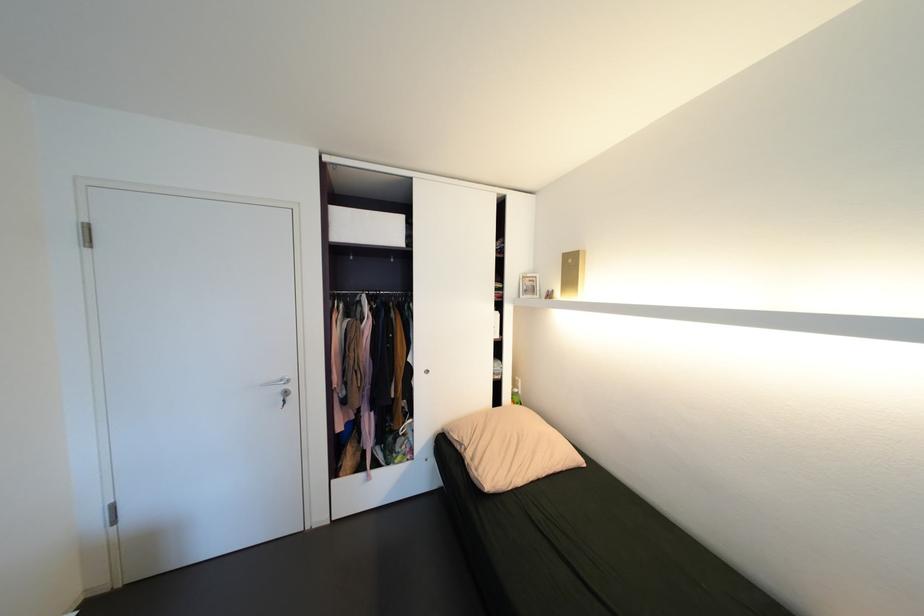
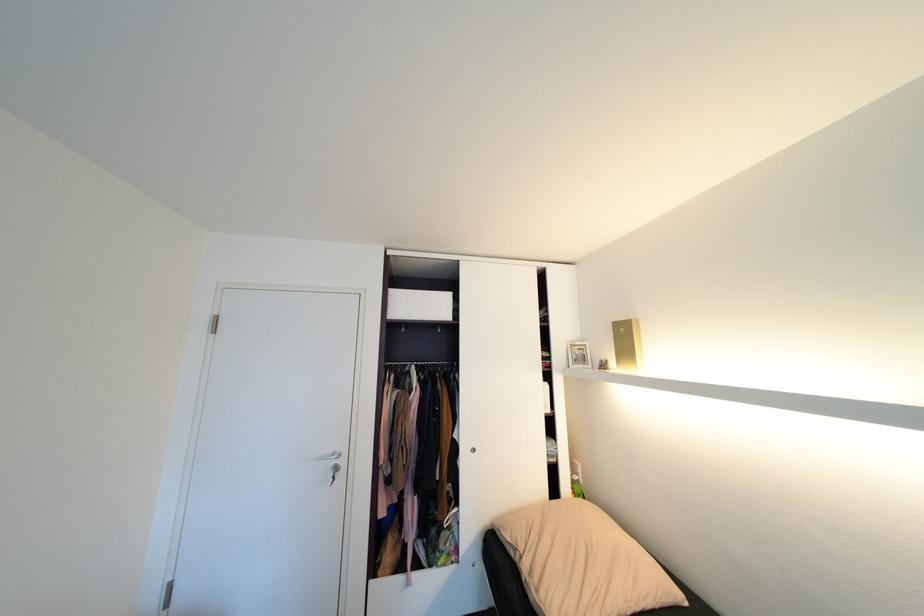
In a continuous first-person perspective shot, in which direction is the camera moving?

The cameraman moved toward left, backward.